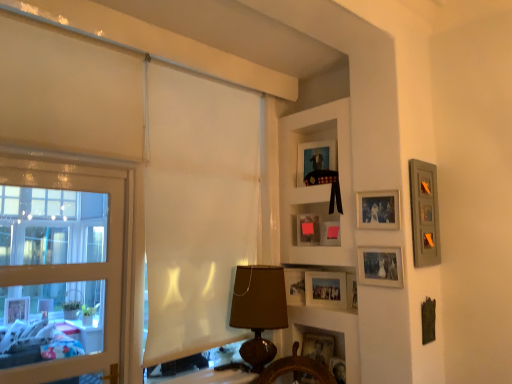
The width and height of the screenshot is (512, 384). Find the location of `free space above wooden picture frame at lower center, arranged as the second picture frame when ordered from the bottom (from a real-world perspective)`. free space above wooden picture frame at lower center, arranged as the second picture frame when ordered from the bottom (from a real-world perspective) is located at coordinates (315, 339).